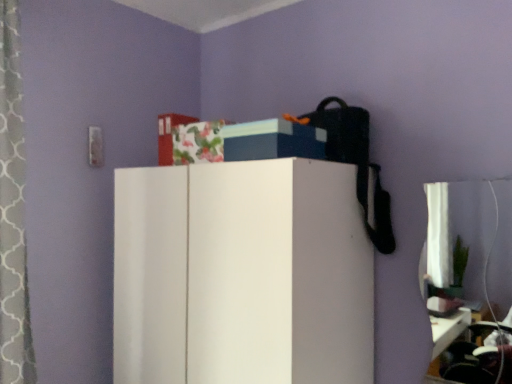
Question: From a real-world perspective, does blue matte storage box at upper center sit lower than white matte cabinet at center?

Choices:
 (A) yes
 (B) no

Answer: (B)

Question: Can you confirm if blue matte storage box at upper center is positioned to the left of white matte cabinet at center?

Choices:
 (A) no
 (B) yes

Answer: (A)

Question: Considering the relative sizes of blue matte storage box at upper center and white matte cabinet at center in the image provided, is blue matte storage box at upper center bigger than white matte cabinet at center?

Choices:
 (A) yes
 (B) no

Answer: (B)

Question: Is blue matte storage box at upper center looking in the opposite direction of white matte cabinet at center?

Choices:
 (A) no
 (B) yes

Answer: (A)

Question: Is blue matte storage box at upper center touching white matte cabinet at center?

Choices:
 (A) yes
 (B) no

Answer: (B)

Question: Is blue matte storage box at upper center positioned in front of white matte cabinet at center?

Choices:
 (A) yes
 (B) no

Answer: (B)

Question: Could you tell me if white matte cabinet at center is facing blue matte storage box at upper center?

Choices:
 (A) no
 (B) yes

Answer: (A)

Question: Is white matte cabinet at center wider than blue matte storage box at upper center?

Choices:
 (A) no
 (B) yes

Answer: (B)

Question: Is white matte cabinet at center located outside blue matte storage box at upper center?

Choices:
 (A) yes
 (B) no

Answer: (A)

Question: Is white matte cabinet at center to the left of blue matte storage box at upper center from the viewer's perspective?

Choices:
 (A) yes
 (B) no

Answer: (A)

Question: From the image's perspective, would you say white matte cabinet at center is positioned over blue matte storage box at upper center?

Choices:
 (A) no
 (B) yes

Answer: (A)

Question: Does white matte cabinet at center have a lesser height compared to blue matte storage box at upper center?

Choices:
 (A) yes
 (B) no

Answer: (B)

Question: Considering their positions, is white matte cabinet at center located in front of or behind blue matte storage box at upper center?

Choices:
 (A) front
 (B) behind

Answer: (A)